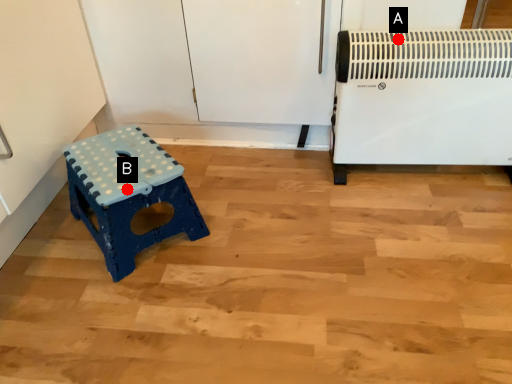
Question: Two points are circled on the image, labeled by A and B beside each circle. Which point is further to the camera?

Choices:
 (A) A is further
 (B) B is further

Answer: (A)